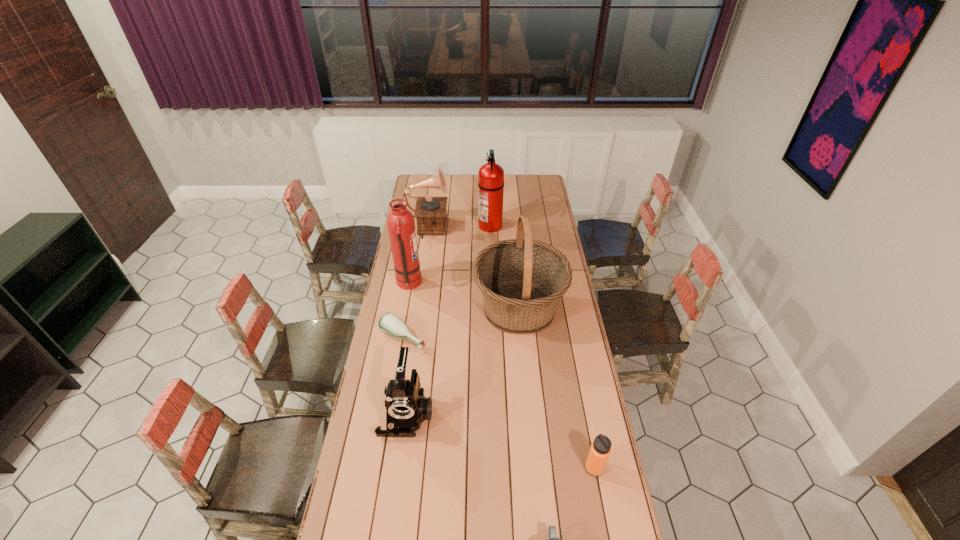
This screenshot has width=960, height=540. I want to click on vacant space that's between the camcorder and the basket, so click(463, 361).

At what (x,y) coordinates should I click in order to perform the action: click on vacant area between the basket and the left fire extinguisher. Please return your answer as a coordinate pair (x, y). Looking at the image, I should click on (464, 296).

I want to click on free space between the seventh farthest object and the fourth tallest object, so click(x=510, y=349).

Identify the location of vacant space in between the bottle and the thermos bottle. The width and height of the screenshot is (960, 540). (498, 403).

This screenshot has height=540, width=960. What are the coordinates of `vacant space that is in between the third nearest object and the fifth shortest object` in the screenshot? It's located at (417, 322).

Where is `empty location between the camcorder and the bottle`? The width and height of the screenshot is (960, 540). empty location between the camcorder and the bottle is located at coordinates (405, 376).

You are a GUI agent. You are given a task and a screenshot of the screen. Output one action in this format:
    pyautogui.click(x=<x>, y=<y>)
    Task: Click on the object identified as the second closest to the camcorder
    This screenshot has width=960, height=540.
    Given the screenshot: What is the action you would take?
    pyautogui.click(x=522, y=280)

Locate an element on the screen. object that is the second closest to the nearer fire extinguisher is located at coordinates (430, 212).

This screenshot has height=540, width=960. What are the coordinates of `vacant space that satisfies the following two spatial constraints: 1. on the horn of the record player; 2. on the left side of the basket` in the screenshot? It's located at (415, 308).

Locate an element on the screen. This screenshot has height=540, width=960. vacant region that satisfies the following two spatial constraints: 1. on the horn of the basket; 2. on the right side of the fifth shortest object is located at coordinates (415, 308).